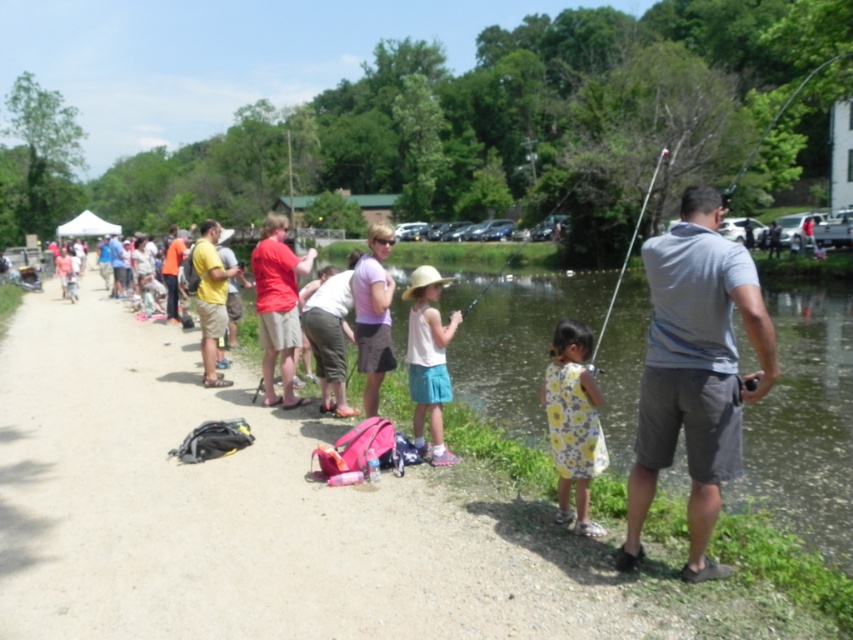
Is the position of yellow t-shirt at center more distant than that of metallic silver fishing pole at right?

Yes, it is.

Does yellow t-shirt at center appear under metallic silver fishing pole at right?

Correct, yellow t-shirt at center is located below metallic silver fishing pole at right.

The height and width of the screenshot is (640, 853). Describe the element at coordinates (210, 300) in the screenshot. I see `yellow t-shirt at center` at that location.

You are a GUI agent. You are given a task and a screenshot of the screen. Output one action in this format:
    pyautogui.click(x=<x>, y=<y>)
    Task: Click on the yellow t-shirt at center
    Image resolution: width=853 pixels, height=640 pixels.
    Given the screenshot: What is the action you would take?
    pyautogui.click(x=210, y=300)

Who is more distant from viewer, (x=289, y=400) or (x=596, y=349)?

Point (x=596, y=349)

Which of these two, matte red shirt at center or metallic silver fishing pole at right, stands taller?

→ With more height is metallic silver fishing pole at right.

Between point (281, 362) and point (659, 156), which one is positioned in front?

Point (281, 362)

Where is `matte red shirt at center`? This screenshot has height=640, width=853. matte red shirt at center is located at coordinates (277, 305).

Looking at this image, is gray cotton shirt at right below yellow floral dress at lower center?

Correct, gray cotton shirt at right is located below yellow floral dress at lower center.

Is point (753, 340) behind point (572, 477)?

No, (753, 340) is closer to viewer.

You are a GUI agent. You are given a task and a screenshot of the screen. Output one action in this format:
    pyautogui.click(x=<x>, y=<y>)
    Task: Click on the gray cotton shirt at right
    This screenshot has height=640, width=853.
    Given the screenshot: What is the action you would take?
    pyautogui.click(x=695, y=371)